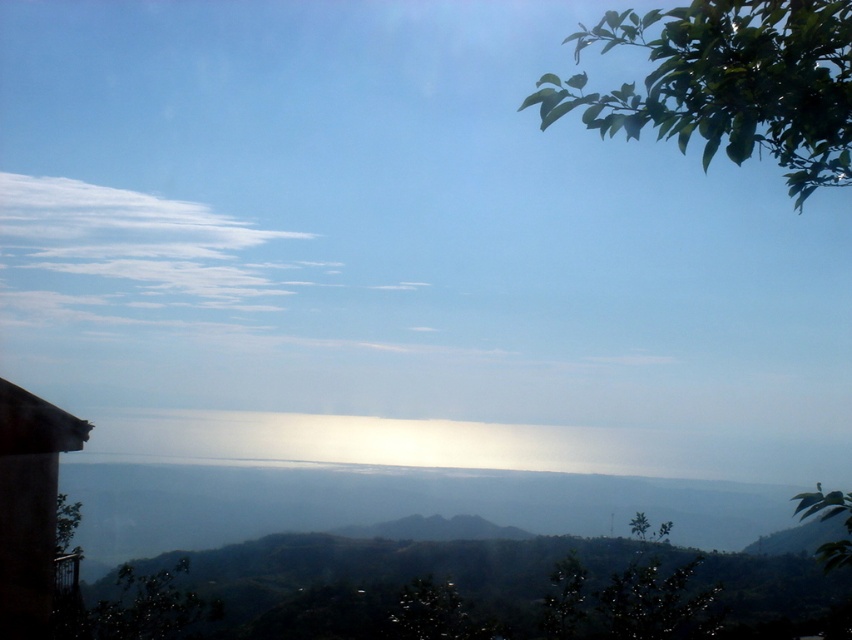
You are standing on the dock and want to place a 3.5 meter long wooden bench between the green leafy tree at upper right and the building silhouette on the left. Will there be enough space for the bench to fit between them?

The distance between the green leafy tree at upper right and the building silhouette on the left is 4.26 meters, which is greater than the bench length of 3.5 meters. Therefore, the bench can be placed between them with sufficient space.

You are standing on the dock looking at the green leafy tree at upper right and the green leafy tree at lower right. Which tree is positioned higher in the image?

The green leafy tree at upper right is positioned higher in the image than the green leafy tree at lower right.